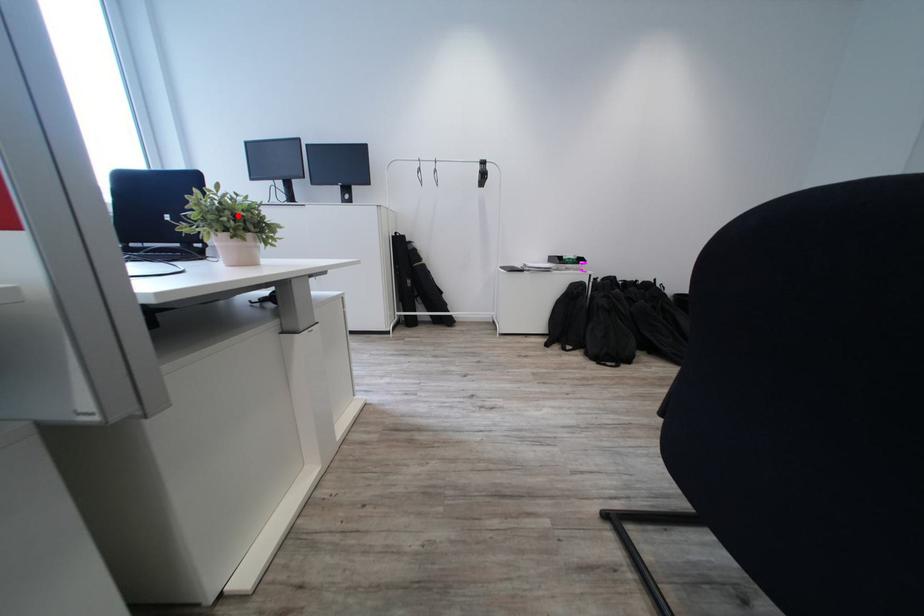
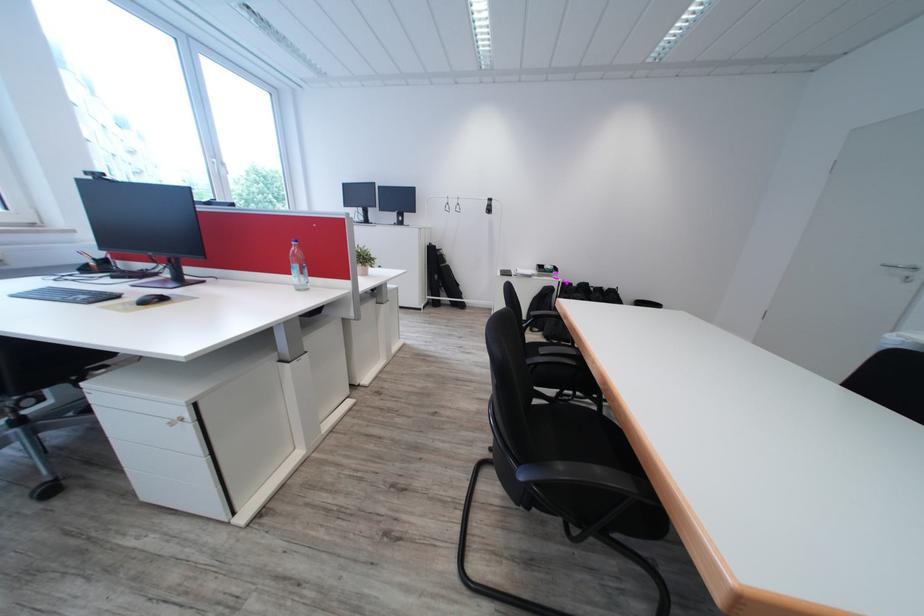
Locate, in the second image, the point that corresponds to the highlighted location in the first image.

(372, 259)